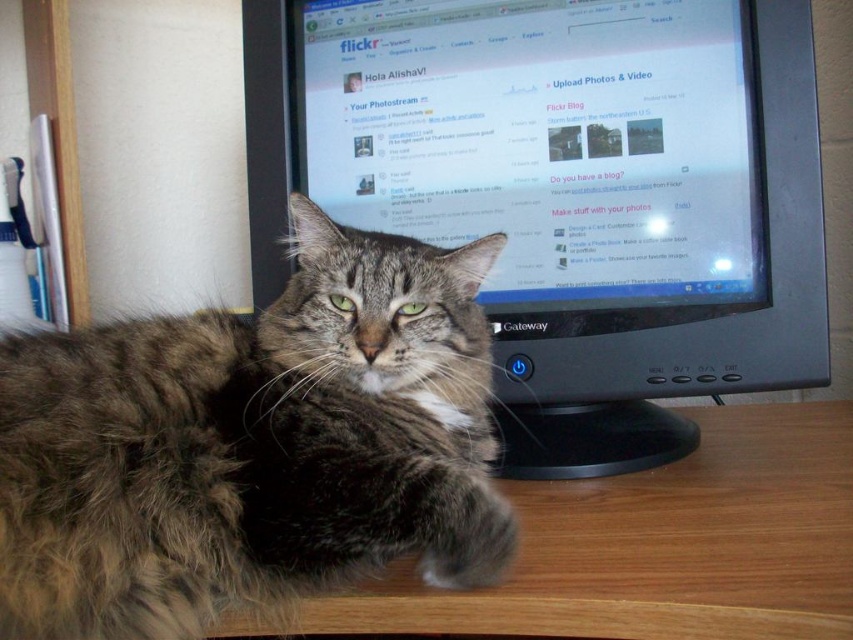
Question: Estimate the real-world distances between objects in this image. Which object is closer to the black plastic monitor at center?

Choices:
 (A) wooden at lower left
 (B) gray tabby cat at center

Answer: (A)

Question: Which point appears closest to the camera in this image?

Choices:
 (A) (639, 573)
 (B) (22, 362)

Answer: (A)

Question: Does black plastic monitor at center appear on the right side of wooden at lower left?

Choices:
 (A) no
 (B) yes

Answer: (A)

Question: Is black plastic monitor at center positioned in front of gray tabby cat at center?

Choices:
 (A) no
 (B) yes

Answer: (A)

Question: Is gray tabby cat at center above wooden at lower left?

Choices:
 (A) yes
 (B) no

Answer: (A)

Question: Which point is closer to the camera?

Choices:
 (A) gray tabby cat at center
 (B) wooden at lower left
 (C) black plastic monitor at center

Answer: (A)